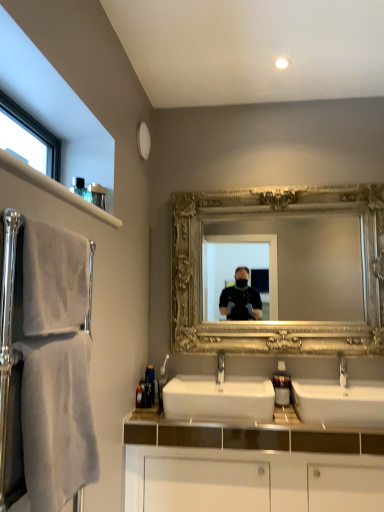
Question: Is silver metallic faucet at center to the left of white ceramic sink at center, which is the second sink from left to right, from the viewer's perspective?

Choices:
 (A) no
 (B) yes

Answer: (A)

Question: Does silver metallic faucet at center have a smaller size compared to white ceramic sink at center, which is the second sink from left to right?

Choices:
 (A) yes
 (B) no

Answer: (A)

Question: Is silver metallic faucet at center behind white ceramic sink at center, which is counted as the 1th sink, starting from the right?

Choices:
 (A) yes
 (B) no

Answer: (A)

Question: Is silver metallic faucet at center touching white ceramic sink at center, which is the second sink from left to right?

Choices:
 (A) yes
 (B) no

Answer: (B)

Question: From a real-world perspective, is silver metallic faucet at center on white ceramic sink at center, which is counted as the 1th sink, starting from the right?

Choices:
 (A) yes
 (B) no

Answer: (A)

Question: Based on their positions, is white textured towel at left, which is counted as the 2th bath towel, starting from the bottom, located to the left or right of white ceramic sink at center, which is the second sink from left to right?

Choices:
 (A) left
 (B) right

Answer: (A)

Question: From the image's perspective, is white textured towel at left, the 1th bath towel in the top-to-bottom sequence, positioned above or below white ceramic sink at center, which is the second sink from left to right?

Choices:
 (A) above
 (B) below

Answer: (A)

Question: Is white textured towel at left, the 1th bath towel in the top-to-bottom sequence, taller or shorter than white ceramic sink at center, which is the second sink from left to right?

Choices:
 (A) short
 (B) tall

Answer: (B)

Question: Considering the positions of point (34, 222) and point (370, 380), is point (34, 222) closer or farther from the camera than point (370, 380)?

Choices:
 (A) farther
 (B) closer

Answer: (B)

Question: Is point (206, 397) positioned closer to the camera than point (38, 294)?

Choices:
 (A) closer
 (B) farther

Answer: (B)

Question: Considering their positions, is white ceramic sink at center, which is counted as the 1th sink, starting from the left, located in front of or behind white textured towel at left, the 1th bath towel in the top-to-bottom sequence?

Choices:
 (A) front
 (B) behind

Answer: (B)

Question: From a real-world perspective, is white ceramic sink at center, which appears as the second sink when viewed from the right, physically located above or below white textured towel at left, which is counted as the 2th bath towel, starting from the bottom?

Choices:
 (A) below
 (B) above

Answer: (A)

Question: Based on their sizes in the image, would you say white ceramic sink at center, which appears as the second sink when viewed from the right, is bigger or smaller than white textured towel at left, which is counted as the 2th bath towel, starting from the bottom?

Choices:
 (A) small
 (B) big

Answer: (B)

Question: Choose the correct answer: Is gold ornate mirror at center inside silver metallic faucet at center or outside it?

Choices:
 (A) inside
 (B) outside

Answer: (B)

Question: From their relative heights in the image, would you say gold ornate mirror at center is taller or shorter than silver metallic faucet at center?

Choices:
 (A) short
 (B) tall

Answer: (B)